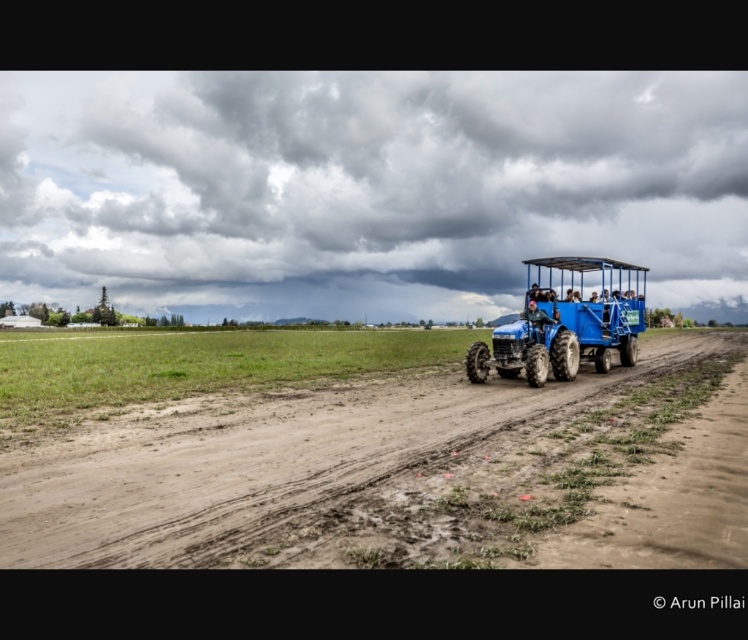
Does point (64, 499) come closer to viewer compared to point (616, 301)?

That is True.

Does dirt field at center appear over blue matte tractor at center?

Actually, dirt field at center is below blue matte tractor at center.

This screenshot has height=640, width=748. What do you see at coordinates (280, 460) in the screenshot? I see `dirt field at center` at bounding box center [280, 460].

The height and width of the screenshot is (640, 748). I want to click on dirt field at center, so click(x=280, y=460).